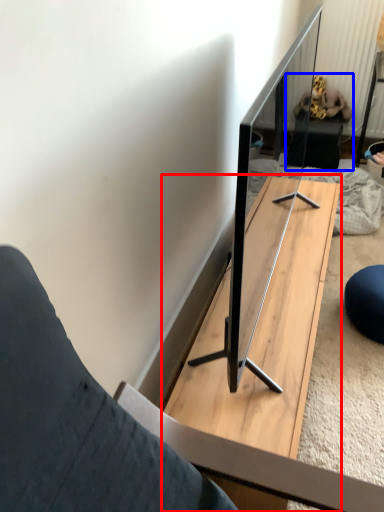
Question: Which of the following is the farthest to the observer, table (highlighted by a red box) or person (highlighted by a blue box)?

Choices:
 (A) table
 (B) person

Answer: (B)